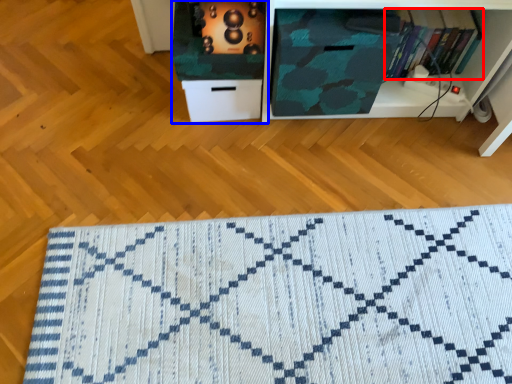
Question: Which point is further to the camera, book (highlighted by a red box) or cabinetry (highlighted by a blue box)?

Choices:
 (A) book
 (B) cabinetry

Answer: (A)